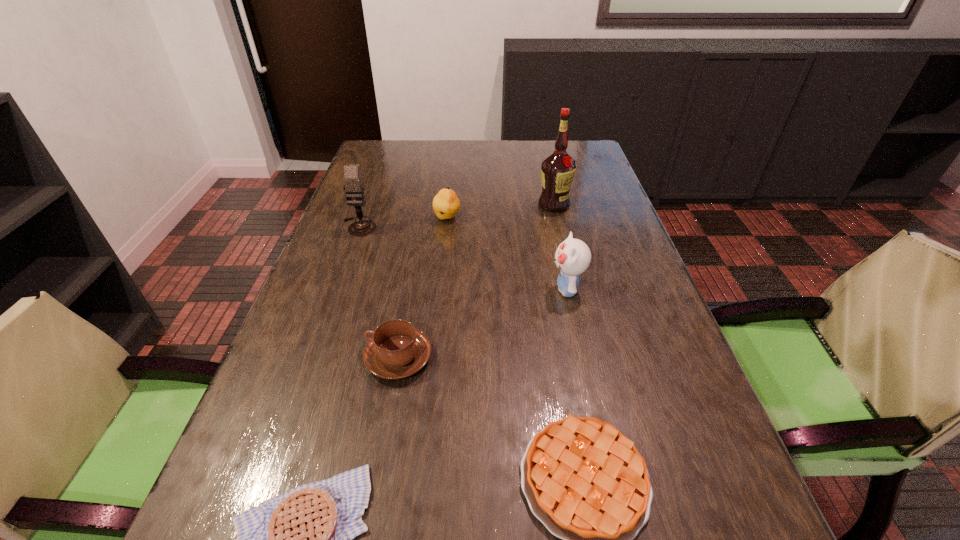
Identify the location of the tallest object. (557, 169).

Locate an element on the screen. The image size is (960, 540). microphone is located at coordinates (354, 187).

Find the location of a particular element. The image size is (960, 540). the fourth nearest object is located at coordinates (572, 257).

At what (x,y) coordinates should I click in order to perform the action: click on kitten. Please return your answer as a coordinate pair (x, y). The width and height of the screenshot is (960, 540). Looking at the image, I should click on (572, 257).

The width and height of the screenshot is (960, 540). What are the coordinates of `the fourth shortest object` in the screenshot? It's located at (446, 204).

Identify the location of the fifth farthest object. (397, 350).

The image size is (960, 540). Identify the location of the fifth tallest object. (397, 350).

Where is `blank space located 0.050m on the label of the tallest object`? blank space located 0.050m on the label of the tallest object is located at coordinates (559, 223).

You are a GUI agent. You are given a task and a screenshot of the screen. Output one action in this format:
    pyautogui.click(x=<x>, y=<y>)
    Task: Click on the free spot located on the front-facing side of the sixth shortest object
    
    Given the screenshot: What is the action you would take?
    pos(321,335)

Where is `free location located 0.160m on the front-facing side of the fourth nearest object`? free location located 0.160m on the front-facing side of the fourth nearest object is located at coordinates (480, 289).